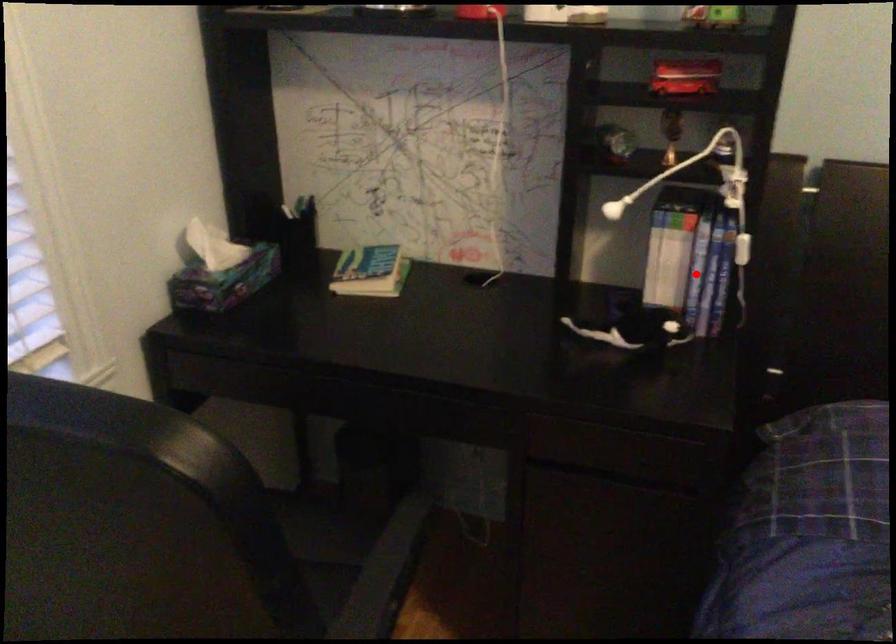
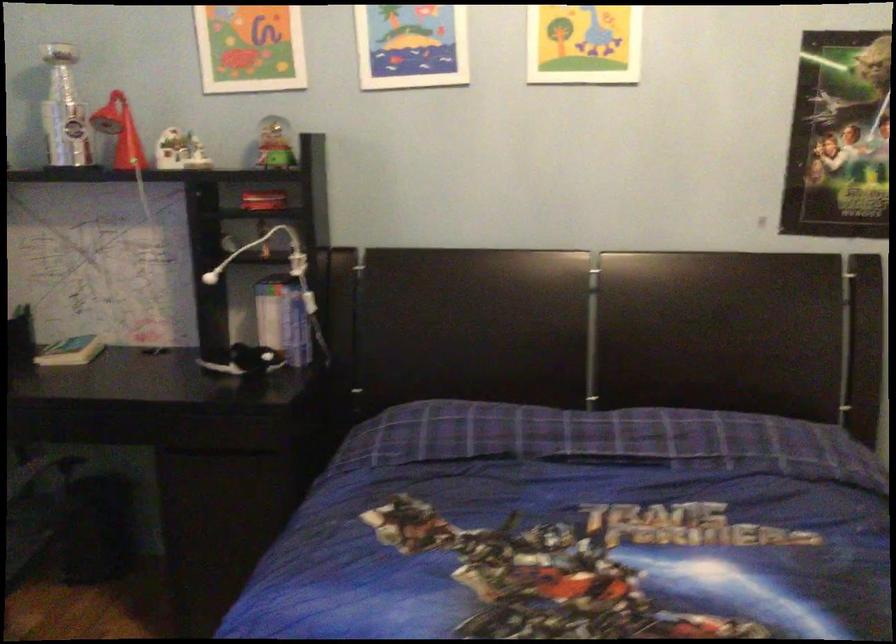
Question: I am providing you with two images of the same scene from different viewpoints. In image1, a red point is highlighted. Considering the same 3D point in image2, which of the following is correct?

Choices:
 (A) It is closer
 (B) It is farther

Answer: (B)